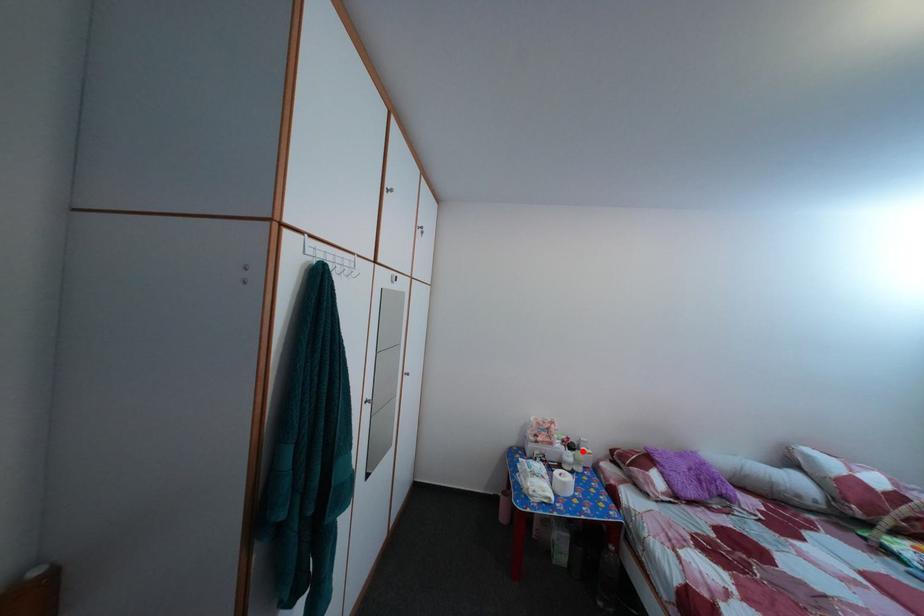
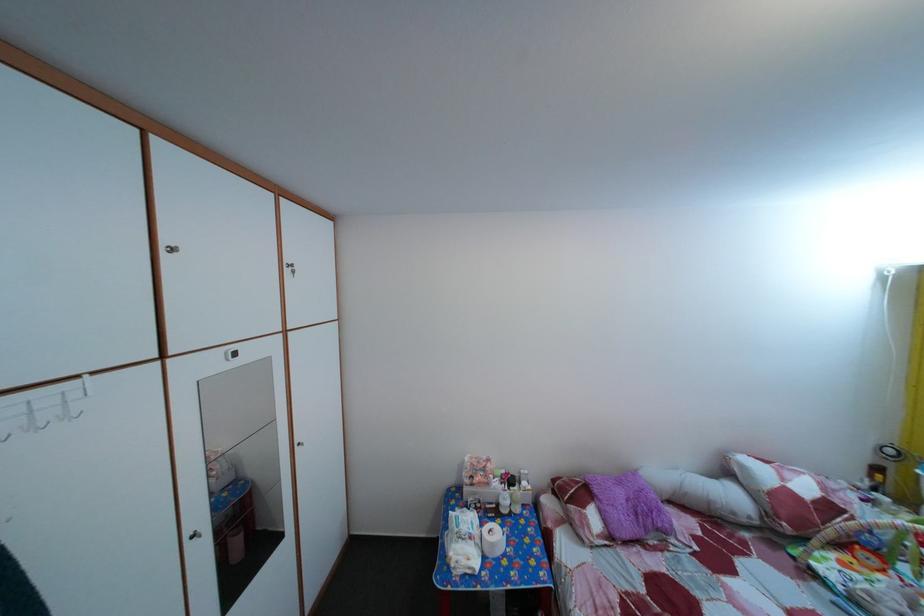
The point at the highlighted location is marked in the first image. Where is the corresponding point in the second image?

(524, 485)